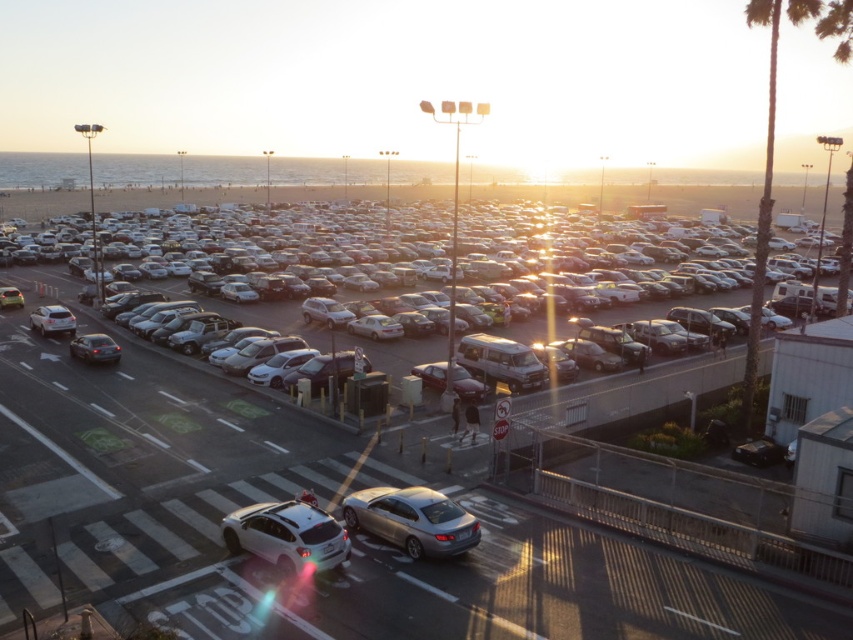
Can you confirm if metallic silver cars at center is positioned to the right of shiny silver sedan at lower left?

Indeed, metallic silver cars at center is positioned on the right side of shiny silver sedan at lower left.

Which of these two, metallic silver cars at center or shiny silver sedan at lower left, stands shorter?

shiny silver sedan at lower left

Measure the distance between metallic silver cars at center and camera.

12.92 meters

I want to click on metallic silver cars at center, so pos(378,484).

Between metallic silver cars at center and silver metallic sedan at center, which one is positioned higher?

silver metallic sedan at center is above.

Can you confirm if metallic silver cars at center is thinner than silver metallic sedan at center?

Correct, metallic silver cars at center's width is less than silver metallic sedan at center's.

Does point (637, 410) come in front of point (520, 368)?

Yes, point (637, 410) is in front of point (520, 368).

Where is `metallic silver cars at center`? This screenshot has width=853, height=640. metallic silver cars at center is located at coordinates (378, 484).

Does shiny silver sedan at lower left appear on the right side of silver metallic sedan at left?

Indeed, shiny silver sedan at lower left is positioned on the right side of silver metallic sedan at left.

Who is positioned more to the left, shiny silver sedan at lower left or silver metallic sedan at left?

silver metallic sedan at left

Where is `shiny silver sedan at lower left`? This screenshot has height=640, width=853. shiny silver sedan at lower left is located at coordinates (94, 348).